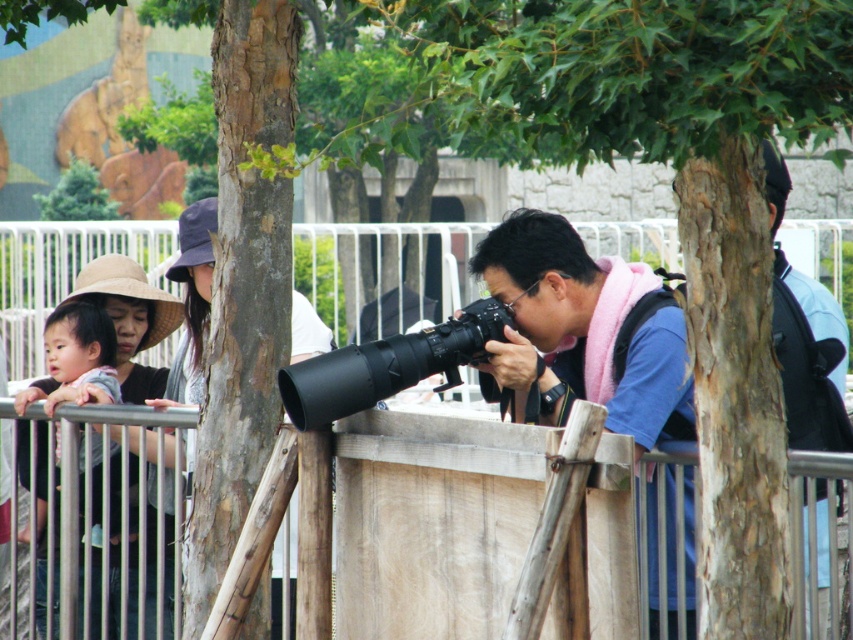
Question: Does blue fabric at center come in front of dark blue shirt at right?

Choices:
 (A) no
 (B) yes

Answer: (A)

Question: Can you confirm if blue fabric at center is bigger than dark blue shirt at right?

Choices:
 (A) yes
 (B) no

Answer: (B)

Question: Which point is farther to the camera?

Choices:
 (A) dark blue shirt at right
 (B) matte black hat at left
 (C) blue fabric at center
 (D) matte gray hat at upper left

Answer: (B)

Question: Does dark blue shirt at right have a larger size compared to matte black hat at left?

Choices:
 (A) yes
 (B) no

Answer: (A)

Question: Which point is farther from the camera taking this photo?

Choices:
 (A) (161, 372)
 (B) (577, 396)

Answer: (A)

Question: Which point is closer to the camera?

Choices:
 (A) wooden at center
 (B) matte gray hat at upper left
 (C) blue fabric at center
 (D) dark blue shirt at right

Answer: (D)